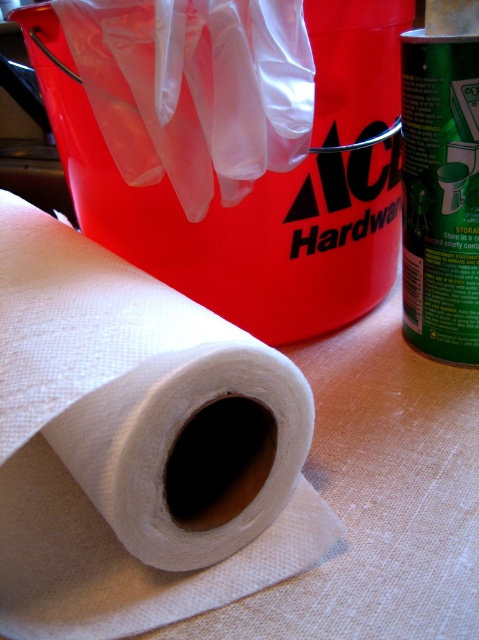
You need to reach for both the white textured paper towel at center and the white fabric roll at center. Which one is closer to your right hand if you are standing to the left of the scene?

The white fabric roll at center is closer to your right hand because it is positioned to the right of the white textured paper towel at center.

You are organizing items on a table and need to place the white textured paper towel at center and the white fabric roll at center in a way that follows the current arrangement. Where should you position them relative to each other?

The white textured paper towel at center should be placed below the white fabric roll at center to maintain the current arrangement.

You are organizing items on a table and need to place a new item between the white textured paper towel at center and the white fabric roll at center. Based on their positions, which one is closer to you so you can position the new item appropriately?

The white textured paper towel at center is closer to the viewer than the white fabric roll at center, so you should place the new item between them by positioning it closer to the white fabric roll at center.